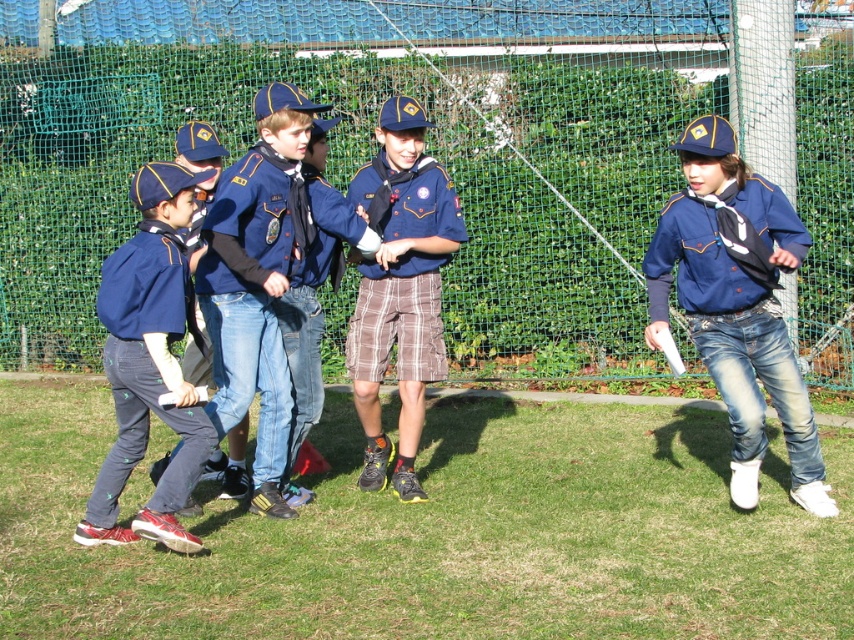
Question: Can you confirm if green grass at lower center is positioned below plaid shorts at center?

Choices:
 (A) yes
 (B) no

Answer: (A)

Question: Which point appears farthest from the camera in this image?

Choices:
 (A) (151, 524)
 (B) (689, 211)
 (C) (366, 344)

Answer: (C)

Question: In this image, where is green grass at lower center located relative to matte blue uniform at left?

Choices:
 (A) above
 (B) below

Answer: (B)

Question: Can you confirm if matte blue uniform at left is smaller than plaid shorts at center?

Choices:
 (A) no
 (B) yes

Answer: (A)

Question: Which object is the closest to the matte blue shirt at center?

Choices:
 (A) matte blue uniform at left
 (B) plaid shorts at center

Answer: (B)

Question: Estimate the real-world distances between objects in this image. Which object is closer to the matte blue uniform at left?

Choices:
 (A) matte blue shirt at center
 (B) green grass at lower center
 (C) plaid shorts at center

Answer: (B)